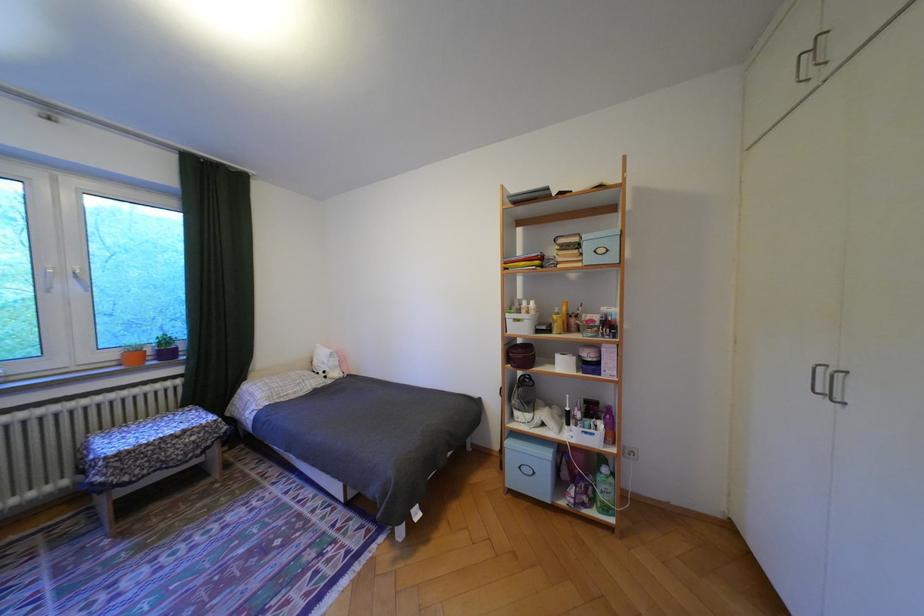
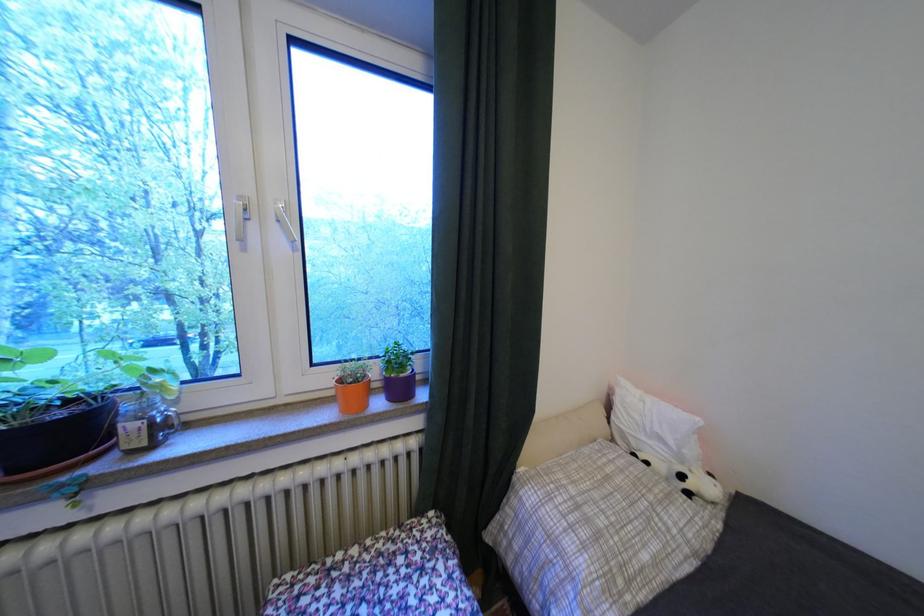
Locate, in the second image, the point that corresponds to point 307,392 in the first image.

(667, 562)